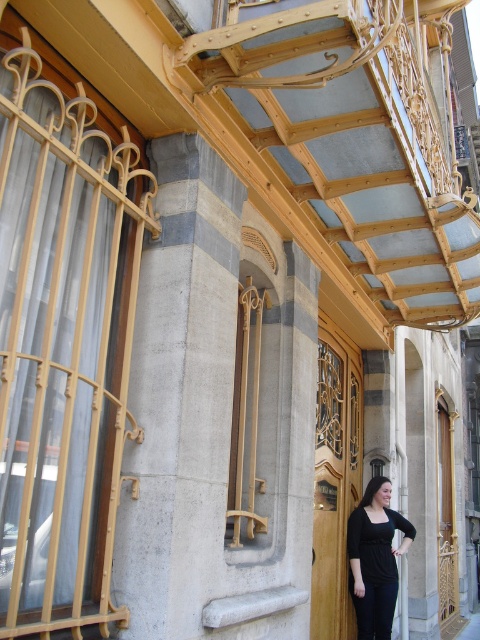
Does wooden rail at left appear over gray stone column at center?

Yes.

Who is shorter, wooden rail at left or gray stone column at center?

Standing shorter between the two is gray stone column at center.

Which is in front, point (21, 140) or point (146, 419)?

Point (21, 140) is more forward.

You are a GUI agent. You are given a task and a screenshot of the screen. Output one action in this format:
    pyautogui.click(x=<x>, y=<y>)
    Task: Click on the wooden rail at left
    
    Given the screenshot: What is the action you would take?
    pyautogui.click(x=62, y=348)

Who is positioned more to the right, wooden rail at left or white concrete pavement at lower right?

From the viewer's perspective, white concrete pavement at lower right appears more on the right side.

Describe the element at coordinates (62, 348) in the screenshot. I see `wooden rail at left` at that location.

Is point (66, 544) farther from viewer compared to point (469, 620)?

No, it is not.

Where is `wooden rail at left`? The image size is (480, 640). wooden rail at left is located at coordinates (62, 348).

Is gray stone column at center wider than black matte dress at lower right?

No.

Does gray stone column at center appear under black matte dress at lower right?

Actually, gray stone column at center is above black matte dress at lower right.

At what (x,y) coordinates should I click in order to perform the action: click on gray stone column at center. Please return your answer as a coordinate pair (x, y). Image resolution: width=480 pixels, height=640 pixels. Looking at the image, I should click on (180, 396).

Locate an element on the screen. This screenshot has height=640, width=480. gray stone column at center is located at coordinates (180, 396).